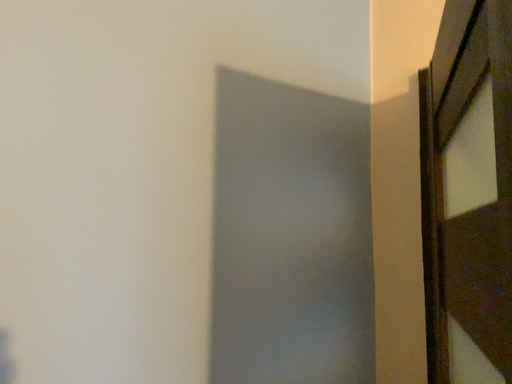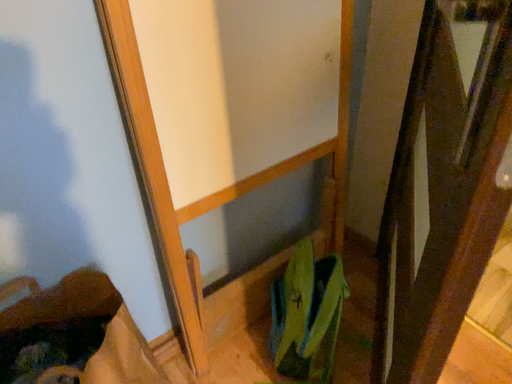
Question: Which way did the camera rotate in the video?

Choices:
 (A) rotated upward
 (B) rotated downward

Answer: (B)